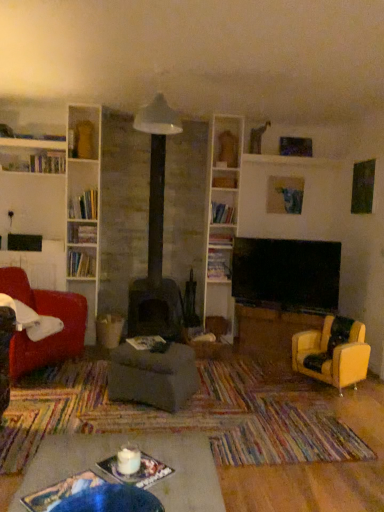
Describe the element at coordinates (153, 376) in the screenshot. I see `dark gray fabric footrest at center` at that location.

Image resolution: width=384 pixels, height=512 pixels. What do you see at coordinates (285, 195) in the screenshot? I see `matte blue painting at upper center` at bounding box center [285, 195].

The width and height of the screenshot is (384, 512). What do you see at coordinates (223, 212) in the screenshot?
I see `wooden bookshelf at upper center, the first shelf when ordered from right to left` at bounding box center [223, 212].

Where is `velvet red armchair at left, which is counted as the 1th chair, starting from the left`? Image resolution: width=384 pixels, height=512 pixels. velvet red armchair at left, which is counted as the 1th chair, starting from the left is located at coordinates (45, 315).

The image size is (384, 512). What are the coordinates of `yellow leather armchair at right, acting as the second chair starting from the left` in the screenshot? It's located at (333, 352).

What do you see at coordinates (333, 352) in the screenshot?
I see `yellow leather armchair at right, acting as the second chair starting from the left` at bounding box center [333, 352].

In order to click on dark gray fabric footrest at center in this screenshot , I will do `click(153, 376)`.

Looking at the image, does white glossy bookshelf at upper left, which is the third shelf from top to bottom, seem bigger or smaller compared to yellow leather armchair at right, acting as the second chair starting from the left?

In the image, white glossy bookshelf at upper left, which is the third shelf from top to bottom, appears to be smaller than yellow leather armchair at right, acting as the second chair starting from the left.

Which object is positioned more to the right, white glossy bookshelf at upper left, acting as the second shelf starting from the bottom, or yellow leather armchair at right, the first chair when ordered from right to left?

yellow leather armchair at right, the first chair when ordered from right to left, is more to the right.

Does point (89, 250) lie in front of point (321, 337)?

No, it is behind (321, 337).

How different are the orientations of white glossy bookshelf at upper left, which is the third shelf from top to bottom, and yellow leather armchair at right, the first chair when ordered from right to left, in degrees?

There is a 57.8-degree angle between the facing directions of white glossy bookshelf at upper left, which is the third shelf from top to bottom, and yellow leather armchair at right, the first chair when ordered from right to left.

Who is smaller, dark gray fabric footrest at center or white glossy bookshelf at upper left, which appears as the 4th shelf when viewed from the right?

Smaller between the two is white glossy bookshelf at upper left, which appears as the 4th shelf when viewed from the right.

Which object is wider, dark gray fabric footrest at center or white glossy bookshelf at upper left, which is the third shelf from top to bottom?

dark gray fabric footrest at center is wider.

From the image's perspective, which is above, dark gray fabric footrest at center or white glossy bookshelf at upper left, which is the third shelf from top to bottom?

white glossy bookshelf at upper left, which is the third shelf from top to bottom, is shown above in the image.

Is dark gray fabric footrest at center inside or outside of white glossy bookshelf at upper left, which appears as the 4th shelf when viewed from the right?

dark gray fabric footrest at center exists outside the volume of white glossy bookshelf at upper left, which appears as the 4th shelf when viewed from the right.

Is wooden bookshelf at upper center, marked as the 4th shelf in a left-to-right arrangement, next to yellow leather armchair at right, acting as the second chair starting from the left, and touching it?

wooden bookshelf at upper center, marked as the 4th shelf in a left-to-right arrangement, and yellow leather armchair at right, acting as the second chair starting from the left, are not in contact.

Is wooden bookshelf at upper center, arranged as the 4th shelf when ordered from the bottom, in front of or behind yellow leather armchair at right, the first chair when ordered from right to left, in the image?

Clearly, wooden bookshelf at upper center, arranged as the 4th shelf when ordered from the bottom, is behind yellow leather armchair at right, the first chair when ordered from right to left.

Considering the relative sizes of wooden bookshelf at upper center, arranged as the 4th shelf when ordered from the bottom, and yellow leather armchair at right, acting as the second chair starting from the left, in the image provided, is wooden bookshelf at upper center, arranged as the 4th shelf when ordered from the bottom, bigger than yellow leather armchair at right, acting as the second chair starting from the left,?

No, wooden bookshelf at upper center, arranged as the 4th shelf when ordered from the bottom, is not bigger than yellow leather armchair at right, acting as the second chair starting from the left.

Could you tell me if wooden bookshelf at upper center, the first shelf when ordered from right to left, is turned towards yellow leather armchair at right, acting as the second chair starting from the left?

No, wooden bookshelf at upper center, the first shelf when ordered from right to left, does not turn towards yellow leather armchair at right, acting as the second chair starting from the left.

Is white glossy bookshelf at upper left, the 1th shelf in the left-to-right sequence, not inside wooden bookshelf at center, placed as the 2th shelf when sorted from left to right?

Yes, white glossy bookshelf at upper left, the 1th shelf in the left-to-right sequence, is not within wooden bookshelf at center, placed as the 2th shelf when sorted from left to right.

Considering the sizes of objects white glossy bookshelf at upper left, which appears as the 4th shelf when viewed from the right, and wooden bookshelf at center, placed as the 2th shelf when sorted from left to right, in the image provided, who is smaller, white glossy bookshelf at upper left, which appears as the 4th shelf when viewed from the right, or wooden bookshelf at center, placed as the 2th shelf when sorted from left to right,?

With smaller size is wooden bookshelf at center, placed as the 2th shelf when sorted from left to right.

From a real-world perspective, which object rests below the other?

white glossy bookshelf at upper left, acting as the second shelf starting from the bottom, from a real-world perspective.

From the image's perspective, between white glossy bookshelf at upper center, positioned as the third shelf in bottom-to-top order, and yellow leather armchair at right, acting as the second chair starting from the left, which one is located above?

white glossy bookshelf at upper center, positioned as the third shelf in bottom-to-top order, appears higher in the image.

Identify the location of the 3rd shelf located above the yellow leather armchair at right, acting as the second chair starting from the left (from a real-world perspective). The width and height of the screenshot is (384, 512). (221, 237).

Is white glossy bookshelf at upper center, marked as the 2th shelf in a right-to-left arrangement, facing towards yellow leather armchair at right, acting as the second chair starting from the left?

No, white glossy bookshelf at upper center, marked as the 2th shelf in a right-to-left arrangement, does not turn towards yellow leather armchair at right, acting as the second chair starting from the left.

From a real-world perspective, is white glossy bookshelf at upper center, which ranks as the 3th shelf in left-to-right order, positioned under yellow leather armchair at right, acting as the second chair starting from the left, based on gravity?

Incorrect, from a real-world perspective, white glossy bookshelf at upper center, which ranks as the 3th shelf in left-to-right order, is higher than yellow leather armchair at right, acting as the second chair starting from the left.

Between wooden bookshelf at upper center, the first shelf when ordered from right to left, and white glossy bookshelf at upper left, acting as the second shelf starting from the bottom, which one has more height?

white glossy bookshelf at upper left, acting as the second shelf starting from the bottom, is taller.

Is white glossy bookshelf at upper left, which is the third shelf from top to bottom, at the back of wooden bookshelf at upper center, the first shelf when ordered from right to left?

No, wooden bookshelf at upper center, the first shelf when ordered from right to left, is not facing the opposite direction of white glossy bookshelf at upper left, which is the third shelf from top to bottom.

Is wooden bookshelf at upper center, which is the 1th shelf from top to bottom, beside white glossy bookshelf at upper left, the 1th shelf in the left-to-right sequence?

No, wooden bookshelf at upper center, which is the 1th shelf from top to bottom, is not in contact with white glossy bookshelf at upper left, the 1th shelf in the left-to-right sequence.

Measure the distance between wooden bookshelf at upper center, the first shelf when ordered from right to left, and white glossy bookshelf at upper left, which appears as the 4th shelf when viewed from the right.

wooden bookshelf at upper center, the first shelf when ordered from right to left, is 1.46 meters away from white glossy bookshelf at upper left, which appears as the 4th shelf when viewed from the right.

Is wooden bookshelf at center, the first shelf in the bottom-to-top sequence, in contact with yellow leather armchair at right, acting as the second chair starting from the left?

No, wooden bookshelf at center, the first shelf in the bottom-to-top sequence, is not in contact with yellow leather armchair at right, acting as the second chair starting from the left.

Based on the photo, from a real-world perspective, is wooden bookshelf at center, the first shelf in the bottom-to-top sequence, below yellow leather armchair at right, acting as the second chair starting from the left?

Incorrect, from a real-world perspective, wooden bookshelf at center, the first shelf in the bottom-to-top sequence, is higher than yellow leather armchair at right, acting as the second chair starting from the left.

Is wooden bookshelf at center, the first shelf in the bottom-to-top sequence, aimed at yellow leather armchair at right, acting as the second chair starting from the left?

No, wooden bookshelf at center, the first shelf in the bottom-to-top sequence, is not oriented towards yellow leather armchair at right, acting as the second chair starting from the left.

At what (x,y) coordinates should I click in order to perform the action: click on shelf that is the 1st one when counting backward from the yellow leather armchair at right, acting as the second chair starting from the left. Please return your answer as a coordinate pair (x, y). Image resolution: width=384 pixels, height=512 pixels. Looking at the image, I should click on (81, 263).

At what (x,y) coordinates should I click in order to perform the action: click on the 2nd shelf above when counting from the dark gray fabric footrest at center (from the image's perspective). Please return your answer as a coordinate pair (x, y). This screenshot has height=512, width=384. Looking at the image, I should click on (81, 263).

Looking at the image, which one is located further to wooden bookshelf at upper center, marked as the 4th shelf in a left-to-right arrangement, white glossy bookshelf at upper center, which ranks as the 3th shelf in left-to-right order, or white glossy bookshelf at upper left, acting as the second shelf starting from the bottom?

white glossy bookshelf at upper left, acting as the second shelf starting from the bottom, is further to wooden bookshelf at upper center, marked as the 4th shelf in a left-to-right arrangement.

Estimate the real-world distances between objects in this image. Which object is further from white glossy bookshelf at upper left, acting as the second shelf starting from the bottom, wooden bookshelf at upper center, arranged as the 4th shelf when ordered from the bottom, or yellow leather armchair at right, acting as the second chair starting from the left?

The object further to white glossy bookshelf at upper left, acting as the second shelf starting from the bottom, is yellow leather armchair at right, acting as the second chair starting from the left.

Consider the image. When comparing their distances from velvet red armchair at left, which is counted as the 1th chair, starting from the left, does white glossy bookshelf at upper left, which appears as the 4th shelf when viewed from the right, or matte blue painting at upper center seem further?

Among the two, matte blue painting at upper center is located further to velvet red armchair at left, which is counted as the 1th chair, starting from the left.

Consider the image. When comparing their distances from wooden bookshelf at upper center, the first shelf when ordered from right to left, does dark gray fabric footrest at center or white glossy bookshelf at upper center, which ranks as the 3th shelf in left-to-right order, seem further?

dark gray fabric footrest at center is further to wooden bookshelf at upper center, the first shelf when ordered from right to left.

Which object lies nearer to the anchor point velvet red armchair at left, which is counted as the 1th chair, starting from the left, white glossy bookshelf at upper left, acting as the second shelf starting from the bottom, or dark gray fabric footrest at center?

dark gray fabric footrest at center.

From the image, which object appears to be farther from white glossy bookshelf at upper left, acting as the second shelf starting from the bottom, dark gray fabric footrest at center or wooden bookshelf at center, acting as the 4th shelf starting from the top?

dark gray fabric footrest at center.

When comparing their distances from matte blue painting at upper center, does white glossy bookshelf at upper left, which appears as the 4th shelf when viewed from the right, or velvet red armchair at left, placed as the second chair when sorted from right to left, seem closer?

Among the two, white glossy bookshelf at upper left, which appears as the 4th shelf when viewed from the right, is located nearer to matte blue painting at upper center.

Considering their positions, is velvet red armchair at left, which is counted as the 1th chair, starting from the left, positioned closer to white glossy bookshelf at upper center, positioned as the third shelf in bottom-to-top order, than white glossy bookshelf at upper left, which appears as the 4th shelf when viewed from the right?

Among the two, white glossy bookshelf at upper left, which appears as the 4th shelf when viewed from the right, is located nearer to white glossy bookshelf at upper center, positioned as the third shelf in bottom-to-top order.

I want to click on the footrest located between velvet red armchair at left, placed as the second chair when sorted from right to left, and matte blue painting at upper center in the left-right direction, so click(153, 376).

Find the location of `the footrest situated between velvet red armchair at left, which is counted as the 1th chair, starting from the left, and wooden bookshelf at upper center, marked as the 4th shelf in a left-to-right arrangement, from left to right`. the footrest situated between velvet red armchair at left, which is counted as the 1th chair, starting from the left, and wooden bookshelf at upper center, marked as the 4th shelf in a left-to-right arrangement, from left to right is located at coordinates (153, 376).

I want to click on shelf between dark gray fabric footrest at center and wooden bookshelf at upper center, marked as the 4th shelf in a left-to-right arrangement, in the front-back direction, so click(x=81, y=263).

The image size is (384, 512). I want to click on footrest between velvet red armchair at left, which is counted as the 1th chair, starting from the left, and yellow leather armchair at right, the first chair when ordered from right to left, so click(153, 376).